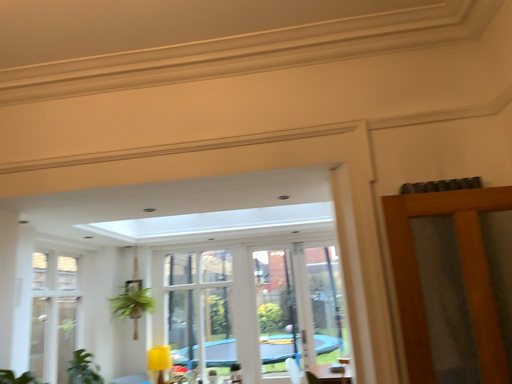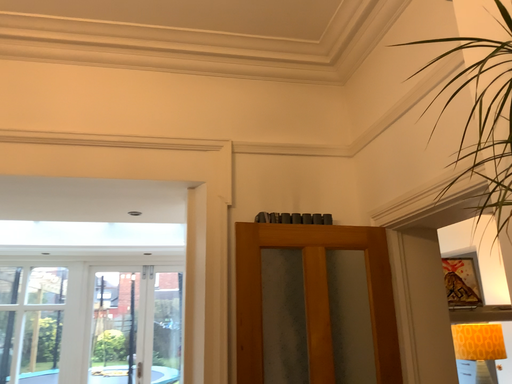
Question: How did the camera likely rotate when shooting the video?

Choices:
 (A) rotated right
 (B) rotated left

Answer: (A)